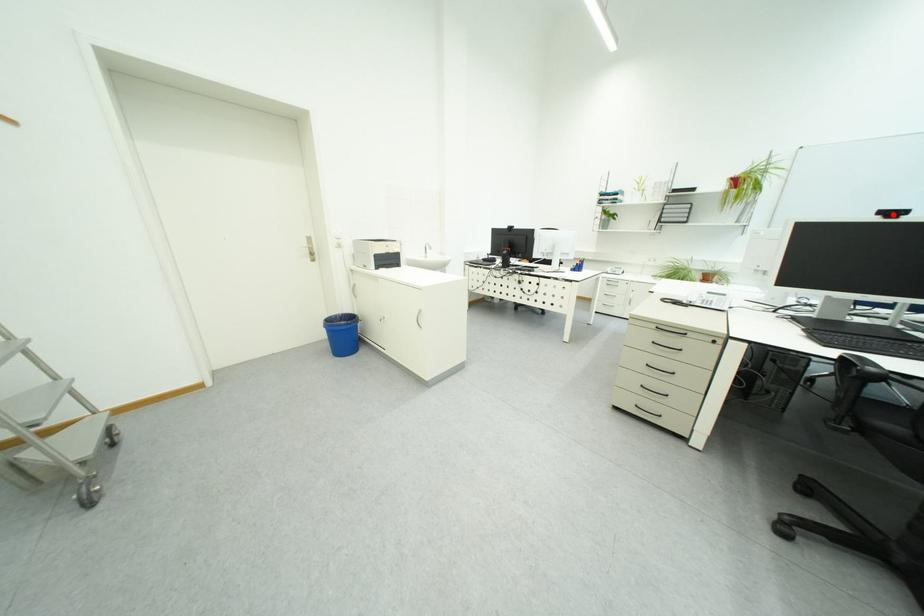
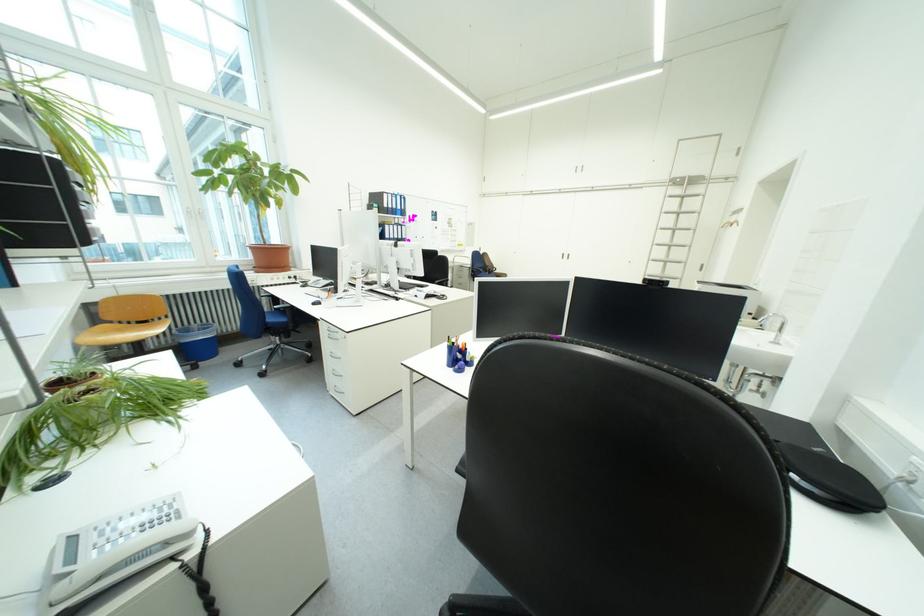
Question: I am providing you with two images of the same scene from different viewpoints. A red point is marked on the first image. Can you still see the location of the red point in image 2?

Choices:
 (A) Yes
 (B) No

Answer: (B)